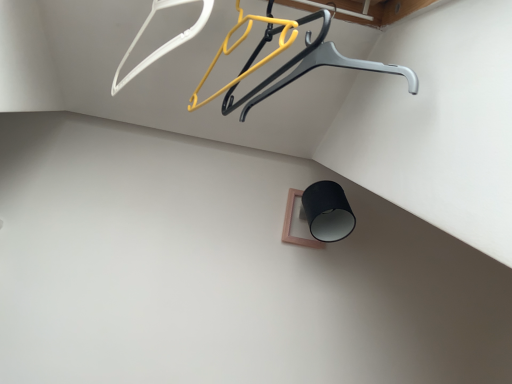
Image resolution: width=512 pixels, height=384 pixels. What do you see at coordinates (162, 45) in the screenshot? I see `white plastic hanger at upper left, the second hanger from the right` at bounding box center [162, 45].

This screenshot has width=512, height=384. I want to click on white plastic hanger at upper left, which appears as the first hanger when viewed from the left, so click(162, 45).

Can you confirm if white plastic hanger at upper left, which appears as the first hanger when viewed from the left, is thinner than metallic gray hanger at upper center?

Indeed, white plastic hanger at upper left, which appears as the first hanger when viewed from the left, has a lesser width compared to metallic gray hanger at upper center.

How different are the orientations of white plastic hanger at upper left, which appears as the first hanger when viewed from the left, and metallic gray hanger at upper center in degrees?

The angle between the facing direction of white plastic hanger at upper left, which appears as the first hanger when viewed from the left, and the facing direction of metallic gray hanger at upper center is 2.1 degrees.

Is white plastic hanger at upper left, which appears as the first hanger when viewed from the left, at the left side of metallic gray hanger at upper center?

Correct, you'll find white plastic hanger at upper left, which appears as the first hanger when viewed from the left, to the left of metallic gray hanger at upper center.

Does white plastic hanger at upper left, the second hanger from the right, have a larger size compared to metallic gray hanger at upper center?

No.

From the image's perspective, which is above, white plastic hanger at upper left, which appears as the first hanger when viewed from the left, or yellow plastic hanger at upper center, arranged as the second hanger when viewed from the left?

white plastic hanger at upper left, which appears as the first hanger when viewed from the left, appears higher in the image.

How many degrees apart are the facing directions of white plastic hanger at upper left, which appears as the first hanger when viewed from the left, and yellow plastic hanger at upper center, the 1th hanger when ordered from right to left?

white plastic hanger at upper left, which appears as the first hanger when viewed from the left, and yellow plastic hanger at upper center, the 1th hanger when ordered from right to left, are facing 0.000976 degrees away from each other.

How distant is white plastic hanger at upper left, which appears as the first hanger when viewed from the left, from yellow plastic hanger at upper center, arranged as the second hanger when viewed from the left?

white plastic hanger at upper left, which appears as the first hanger when viewed from the left, is 4.83 inches from yellow plastic hanger at upper center, arranged as the second hanger when viewed from the left.

Are white plastic hanger at upper left, which appears as the first hanger when viewed from the left, and yellow plastic hanger at upper center, arranged as the second hanger when viewed from the left, beside each other?

No, white plastic hanger at upper left, which appears as the first hanger when viewed from the left, is not beside yellow plastic hanger at upper center, arranged as the second hanger when viewed from the left.

Is metallic gray hanger at upper center facing towards white plastic hanger at upper left, which appears as the first hanger when viewed from the left?

No, metallic gray hanger at upper center is not facing towards white plastic hanger at upper left, which appears as the first hanger when viewed from the left.

Between metallic gray hanger at upper center and white plastic hanger at upper left, the second hanger from the right, which one has more height?

white plastic hanger at upper left, the second hanger from the right.

Would you say metallic gray hanger at upper center is outside white plastic hanger at upper left, the second hanger from the right?

Yes, metallic gray hanger at upper center is not within white plastic hanger at upper left, the second hanger from the right.

From the image's perspective, is metallic gray hanger at upper center positioned above or below white plastic hanger at upper left, the second hanger from the right?

From the image's perspective, metallic gray hanger at upper center appears below white plastic hanger at upper left, the second hanger from the right.

Is yellow plastic hanger at upper center, arranged as the second hanger when viewed from the left, not near white plastic hanger at upper left, the second hanger from the right?

No, yellow plastic hanger at upper center, arranged as the second hanger when viewed from the left, is not far away from white plastic hanger at upper left, the second hanger from the right.

From the picture: From a real-world perspective, who is located higher, yellow plastic hanger at upper center, the 1th hanger when ordered from right to left, or white plastic hanger at upper left, which appears as the first hanger when viewed from the left?

white plastic hanger at upper left, which appears as the first hanger when viewed from the left.

Does yellow plastic hanger at upper center, arranged as the second hanger when viewed from the left, have a lesser width compared to white plastic hanger at upper left, the second hanger from the right?

No, yellow plastic hanger at upper center, arranged as the second hanger when viewed from the left, is not thinner than white plastic hanger at upper left, the second hanger from the right.

Is yellow plastic hanger at upper center, the 1th hanger when ordered from right to left, aimed at metallic gray hanger at upper center?

No, yellow plastic hanger at upper center, the 1th hanger when ordered from right to left, is not aimed at metallic gray hanger at upper center.

Does yellow plastic hanger at upper center, arranged as the second hanger when viewed from the left, have a smaller size compared to metallic gray hanger at upper center?

Indeed, yellow plastic hanger at upper center, arranged as the second hanger when viewed from the left, has a smaller size compared to metallic gray hanger at upper center.

Between point (204, 79) and point (388, 70), which one is positioned in front?

The point (388, 70) is closer to the camera.

Is metallic gray hanger at upper center facing towards yellow plastic hanger at upper center, the 1th hanger when ordered from right to left?

No, metallic gray hanger at upper center is not aimed at yellow plastic hanger at upper center, the 1th hanger when ordered from right to left.

Considering the relative positions of metallic gray hanger at upper center and yellow plastic hanger at upper center, arranged as the second hanger when viewed from the left, in the image provided, is metallic gray hanger at upper center to the right of yellow plastic hanger at upper center, arranged as the second hanger when viewed from the left, from the viewer's perspective?

Yes, metallic gray hanger at upper center is to the right of yellow plastic hanger at upper center, arranged as the second hanger when viewed from the left.

The image size is (512, 384). Find the location of `furniture on the right of white plastic hanger at upper left, which appears as the first hanger when viewed from the left`. furniture on the right of white plastic hanger at upper left, which appears as the first hanger when viewed from the left is located at coordinates pyautogui.click(x=313, y=67).

Identify the location of hanger lying above the yellow plastic hanger at upper center, arranged as the second hanger when viewed from the left (from the image's perspective). (162, 45).

Which object lies further to the anchor point metallic gray hanger at upper center, white plastic hanger at upper left, which appears as the first hanger when viewed from the left, or yellow plastic hanger at upper center, arranged as the second hanger when viewed from the left?

white plastic hanger at upper left, which appears as the first hanger when viewed from the left, is further to metallic gray hanger at upper center.

Looking at the image, which one is located closer to white plastic hanger at upper left, which appears as the first hanger when viewed from the left, metallic gray hanger at upper center or yellow plastic hanger at upper center, arranged as the second hanger when viewed from the left?

yellow plastic hanger at upper center, arranged as the second hanger when viewed from the left, is closer to white plastic hanger at upper left, which appears as the first hanger when viewed from the left.

Looking at the image, which one is located further to yellow plastic hanger at upper center, arranged as the second hanger when viewed from the left, white plastic hanger at upper left, the second hanger from the right, or metallic gray hanger at upper center?

white plastic hanger at upper left, the second hanger from the right.

Based on their spatial positions, is metallic gray hanger at upper center or white plastic hanger at upper left, which appears as the first hanger when viewed from the left, further from yellow plastic hanger at upper center, arranged as the second hanger when viewed from the left?

The object further to yellow plastic hanger at upper center, arranged as the second hanger when viewed from the left, is white plastic hanger at upper left, which appears as the first hanger when viewed from the left.

Based on their spatial positions, is yellow plastic hanger at upper center, the 1th hanger when ordered from right to left, or metallic gray hanger at upper center closer to white plastic hanger at upper left, the second hanger from the right?

Based on the image, yellow plastic hanger at upper center, the 1th hanger when ordered from right to left, appears to be nearer to white plastic hanger at upper left, the second hanger from the right.

Considering their positions, is yellow plastic hanger at upper center, arranged as the second hanger when viewed from the left, positioned closer to metallic gray hanger at upper center than white plastic hanger at upper left, the second hanger from the right?

Based on the image, yellow plastic hanger at upper center, arranged as the second hanger when viewed from the left, appears to be nearer to metallic gray hanger at upper center.

The height and width of the screenshot is (384, 512). Identify the location of hanger located between white plastic hanger at upper left, the second hanger from the right, and metallic gray hanger at upper center in the left-right direction. (239, 44).